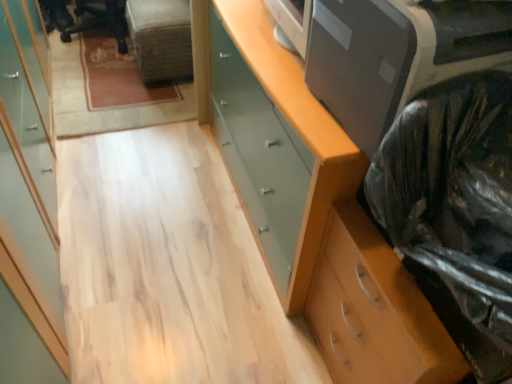
Question: Considering the relative sizes of black plastic bag at right and wooden chest of drawers at right, which is the second chest of drawers in top-to-bottom order, in the image provided, is black plastic bag at right thinner than wooden chest of drawers at right, which is the second chest of drawers in top-to-bottom order,?

Choices:
 (A) no
 (B) yes

Answer: (B)

Question: From a real-world perspective, is black plastic bag at right below wooden chest of drawers at right, which is the second chest of drawers in top-to-bottom order?

Choices:
 (A) yes
 (B) no

Answer: (B)

Question: Can you confirm if black plastic bag at right is bigger than wooden chest of drawers at right, which is the 1th chest of drawers from bottom to top?

Choices:
 (A) yes
 (B) no

Answer: (B)

Question: Does black plastic bag at right have a greater width compared to wooden chest of drawers at right, which is the 1th chest of drawers from bottom to top?

Choices:
 (A) no
 (B) yes

Answer: (A)

Question: Is black plastic bag at right facing towards wooden chest of drawers at right, which is the 1th chest of drawers from bottom to top?

Choices:
 (A) no
 (B) yes

Answer: (A)

Question: Considering the positions of black plastic bag at right and matte green chest of drawers at right, which is counted as the first chest of drawers, starting from the top, in the image, is black plastic bag at right taller or shorter than matte green chest of drawers at right, which is counted as the first chest of drawers, starting from the top,?

Choices:
 (A) short
 (B) tall

Answer: (A)

Question: From the image's perspective, is black plastic bag at right positioned above or below matte green chest of drawers at right, which is counted as the first chest of drawers, starting from the top?

Choices:
 (A) above
 (B) below

Answer: (B)

Question: Visually, is black plastic bag at right positioned to the left or to the right of matte green chest of drawers at right, which is counted as the first chest of drawers, starting from the top?

Choices:
 (A) right
 (B) left

Answer: (A)

Question: Is black plastic bag at right wider or thinner than matte green chest of drawers at right, which is counted as the first chest of drawers, starting from the top?

Choices:
 (A) thin
 (B) wide

Answer: (A)

Question: Looking at the image, does light wood cabinet at left seem bigger or smaller compared to satin gray printer at upper right?

Choices:
 (A) small
 (B) big

Answer: (B)

Question: Is light wood cabinet at left in front of or behind satin gray printer at upper right in the image?

Choices:
 (A) front
 (B) behind

Answer: (A)

Question: Is light wood cabinet at left wider or thinner than satin gray printer at upper right?

Choices:
 (A) wide
 (B) thin

Answer: (B)

Question: Is light wood cabinet at left inside or outside of satin gray printer at upper right?

Choices:
 (A) outside
 (B) inside

Answer: (A)

Question: Relative to wooden chest of drawers at right, which is the 1th chest of drawers from bottom to top, is black plastic bag at right in front or behind?

Choices:
 (A) front
 (B) behind

Answer: (A)

Question: Considering the positions of black plastic bag at right and wooden chest of drawers at right, which is the 1th chest of drawers from bottom to top, in the image, is black plastic bag at right taller or shorter than wooden chest of drawers at right, which is the 1th chest of drawers from bottom to top,?

Choices:
 (A) short
 (B) tall

Answer: (A)